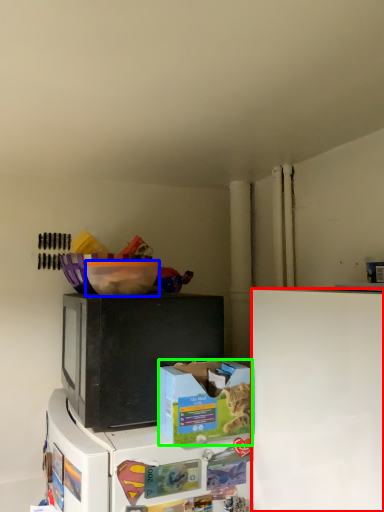
Question: Estimate the real-world distances between objects in this image. Which object is closer to refrigerator (highlighted by a red box), bowl (highlighted by a blue box) or box (highlighted by a green box)?

Choices:
 (A) bowl
 (B) box

Answer: (B)